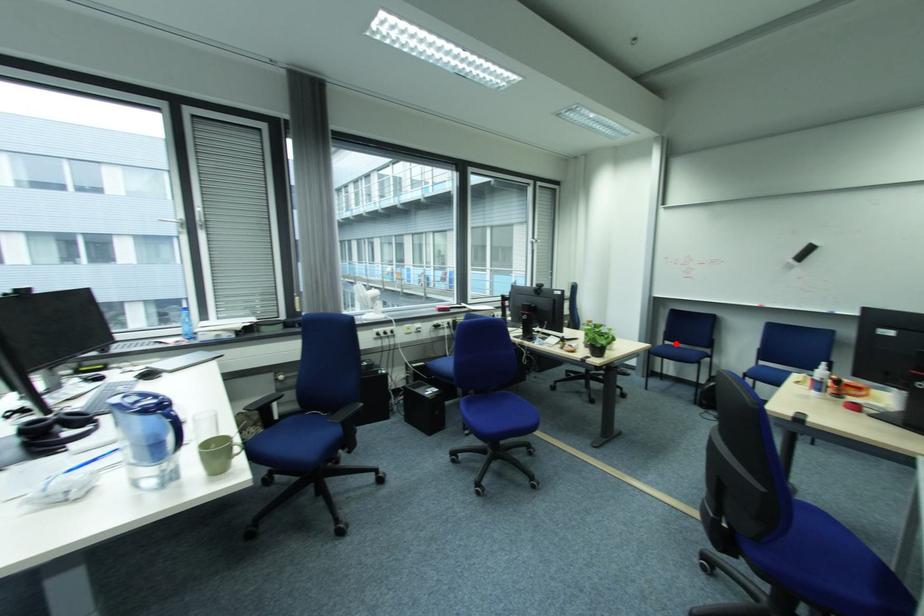
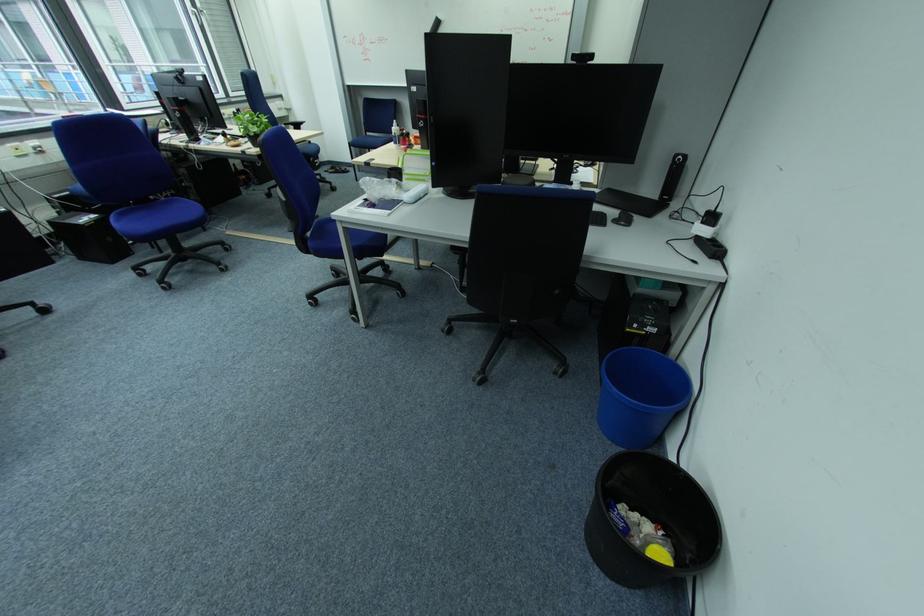
Question: A red point is marked in image1. In image2, is the corresponding 3D point closer to the camera or farther? Reply with the corresponding letter.

Choices:
 (A) The corresponding 3D point is closer.
 (B) The corresponding 3D point is farther.

Answer: (B)